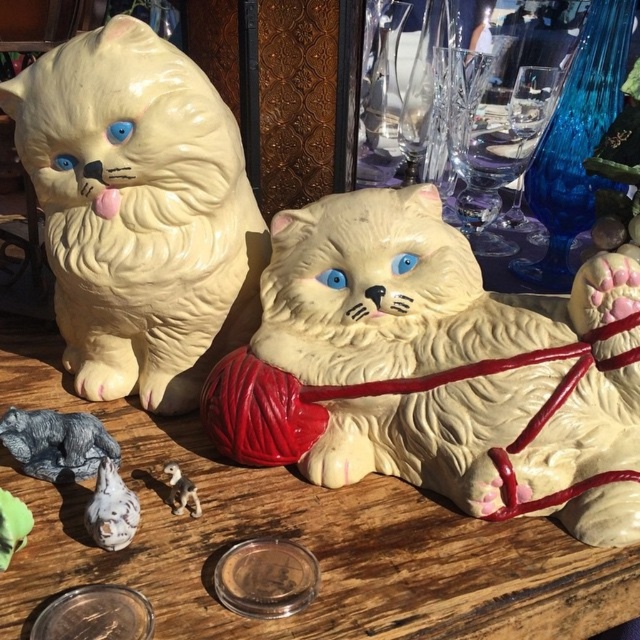
Does textured gray cat at lower left appear on the right side of white glossy figurine at lower center?

In fact, textured gray cat at lower left is to the left of white glossy figurine at lower center.

Can you confirm if textured gray cat at lower left is smaller than white glossy figurine at lower center?

Incorrect, textured gray cat at lower left is not smaller in size than white glossy figurine at lower center.

Is point (13, 435) behind point (195, 488)?

That is True.

Identify the location of textured gray cat at lower left. (56, 444).

From the picture: Who is positioned more to the right, matte white cat at left or white glossy figurine at lower center?

Positioned to the right is white glossy figurine at lower center.

Is matte white cat at left smaller than white glossy figurine at lower center?

Actually, matte white cat at left might be larger than white glossy figurine at lower center.

Does point (72, 104) come in front of point (186, 504)?

That is True.

I want to click on matte white cat at left, so 140,212.

What do you see at coordinates (56, 444) in the screenshot? I see `textured gray cat at lower left` at bounding box center [56, 444].

Does textured gray cat at lower left have a greater height compared to white glossy cat at lower left?

In fact, textured gray cat at lower left may be shorter than white glossy cat at lower left.

Does point (61, 419) come behind point (106, 536)?

Yes, it is.

Find the location of a particular element. textured gray cat at lower left is located at coordinates (56, 444).